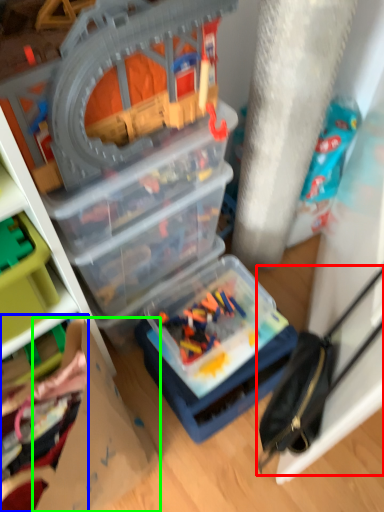
Question: Which is nearer to the accessory (highlighted by a red box)? toy (highlighted by a blue box) or cardboard box (highlighted by a green box).

Choices:
 (A) toy
 (B) cardboard box

Answer: (B)